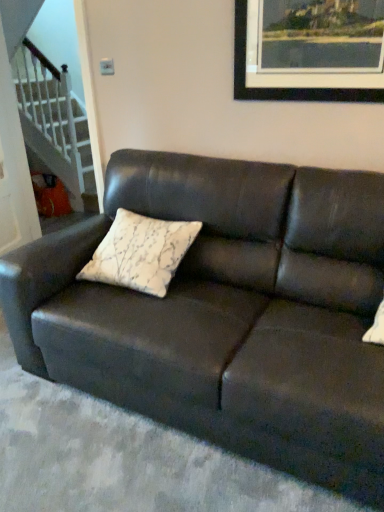
Question: Can we say wooden picture frame at upper center lies outside white glossy staircase at lower left?

Choices:
 (A) no
 (B) yes

Answer: (B)

Question: Considering the relative positions of wooden picture frame at upper center and white glossy staircase at lower left in the image provided, is wooden picture frame at upper center behind white glossy staircase at lower left?

Choices:
 (A) yes
 (B) no

Answer: (B)

Question: From a real-world perspective, is wooden picture frame at upper center on white glossy staircase at lower left?

Choices:
 (A) yes
 (B) no

Answer: (A)

Question: Considering the relative positions of wooden picture frame at upper center and white glossy staircase at lower left in the image provided, is wooden picture frame at upper center to the left of white glossy staircase at lower left from the viewer's perspective?

Choices:
 (A) no
 (B) yes

Answer: (A)

Question: Is wooden picture frame at upper center not close to white glossy staircase at lower left?

Choices:
 (A) no
 (B) yes

Answer: (B)

Question: Can you confirm if wooden picture frame at upper center is wider than white glossy staircase at lower left?

Choices:
 (A) yes
 (B) no

Answer: (B)

Question: Is matte black couch at center far from white glossy staircase at lower left?

Choices:
 (A) yes
 (B) no

Answer: (A)

Question: Is the position of matte black couch at center more distant than that of white glossy staircase at lower left?

Choices:
 (A) no
 (B) yes

Answer: (A)

Question: Does matte black couch at center lie in front of white glossy staircase at lower left?

Choices:
 (A) yes
 (B) no

Answer: (A)

Question: Does matte black couch at center have a smaller size compared to white glossy staircase at lower left?

Choices:
 (A) yes
 (B) no

Answer: (B)

Question: Is matte black couch at center oriented away from white glossy staircase at lower left?

Choices:
 (A) no
 (B) yes

Answer: (A)

Question: From the image's perspective, is matte black couch at center on white glossy staircase at lower left?

Choices:
 (A) yes
 (B) no

Answer: (B)

Question: Is white glossy staircase at lower left smaller than wooden picture frame at upper center?

Choices:
 (A) no
 (B) yes

Answer: (A)